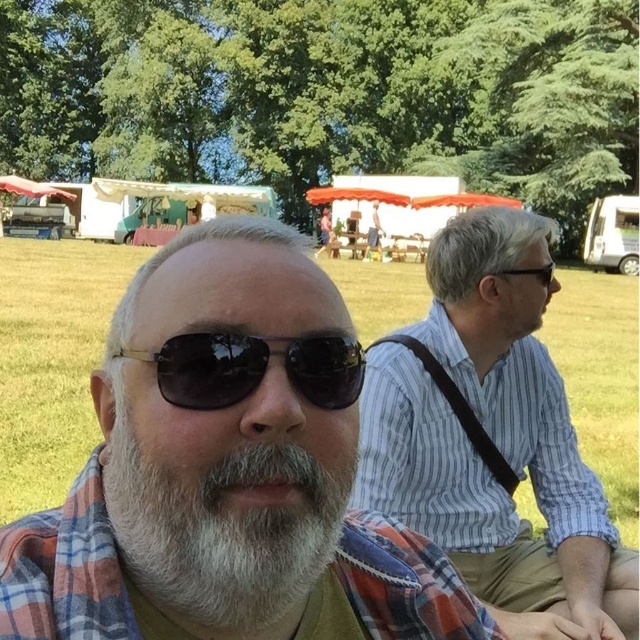
Question: Considering the real-world distances, which object is closest to the white matte beard at center?

Choices:
 (A) plaid fabric shirt at center
 (B) blue striped shirt at right

Answer: (A)

Question: Which is nearer to the white matte beard at center?

Choices:
 (A) metallic aviator sunglasses at center
 (B) plaid fabric shirt at center

Answer: (B)

Question: Observing the image, what is the correct spatial positioning of white matte beard at center in reference to metallic aviator sunglasses at center?

Choices:
 (A) left
 (B) right

Answer: (A)

Question: Which point is farther to the camera?

Choices:
 (A) blue striped shirt at right
 (B) metallic aviator sunglasses at center
 (C) white matte beard at center

Answer: (A)

Question: Does blue striped shirt at right appear on the right side of white matte beard at center?

Choices:
 (A) yes
 (B) no

Answer: (A)

Question: Does plaid fabric shirt at center appear over blue striped shirt at right?

Choices:
 (A) no
 (B) yes

Answer: (B)